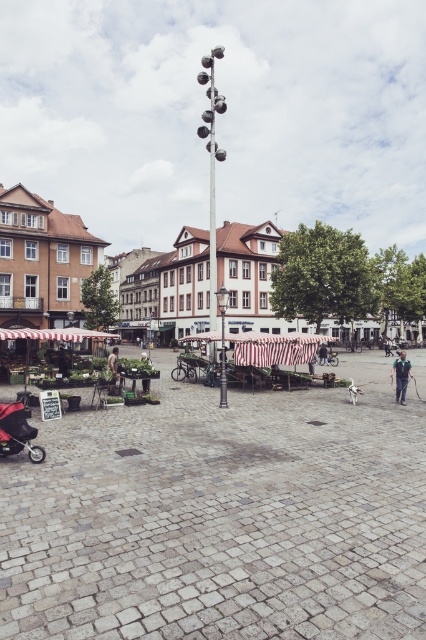
You are a delivery person carrying a box that is 1.2 meters wide. You need to pass through the space between the brown wooden market stalls at lower left and the dark blue jeans at center. Can your box fit through the space?

The brown wooden market stalls at lower left is wider than the dark blue jeans at center, so the space between them may be narrow. Since your box is 1.2 meters wide, it might not fit through the space. Check the exact width before proceeding.

You are a customer at the market and see both the green fabric jacket at lower right and the green fabric umbrella at lower left. Which item is positioned lower in the image?

The green fabric jacket at lower right is positioned below the green fabric umbrella at lower left, so the jacket is lower.